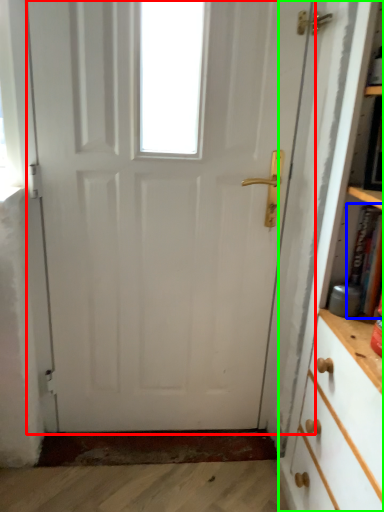
Question: Based on their relative distances, which object is farther from door (highlighted by a red box)? Choose from book (highlighted by a blue box) and bookcase (highlighted by a green box).

Choices:
 (A) book
 (B) bookcase

Answer: (A)